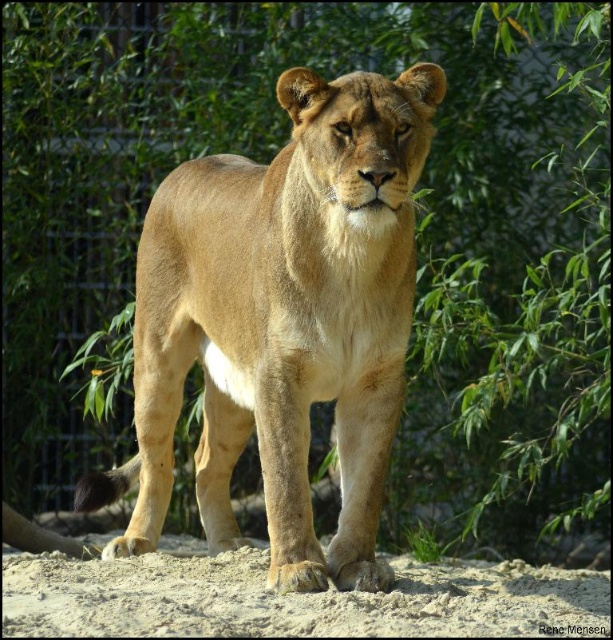
Question: Does golden fur lion at center lie behind light brown sandy ground at lower center?

Choices:
 (A) no
 (B) yes

Answer: (B)

Question: Which point is farther from the camera taking this photo?

Choices:
 (A) (329, 616)
 (B) (403, 301)

Answer: (B)

Question: Which object appears closest to the camera in this image?

Choices:
 (A) light brown sandy ground at lower center
 (B) golden fur lion at center

Answer: (A)

Question: Among these objects, which one is farthest from the camera?

Choices:
 (A) golden fur lion at center
 (B) light brown sandy ground at lower center

Answer: (A)

Question: Can you confirm if golden fur lion at center is positioned to the right of light brown sandy ground at lower center?

Choices:
 (A) yes
 (B) no

Answer: (B)

Question: Where is golden fur lion at center located in relation to light brown sandy ground at lower center in the image?

Choices:
 (A) above
 (B) below

Answer: (A)